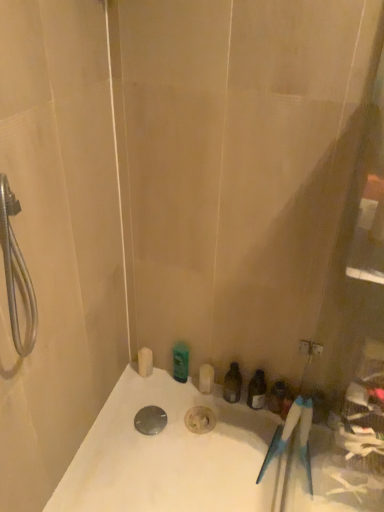
You are a GUI agent. You are given a task and a screenshot of the screen. Output one action in this format:
    pyautogui.click(x=<x>, y=<y>)
    Task: Click on the vacant space in between green matte bottle at upper center, the second toiletry in the left-to-right sequence, and polished metallic drain at center
    The height and width of the screenshot is (512, 384).
    Given the screenshot: What is the action you would take?
    pyautogui.click(x=168, y=403)